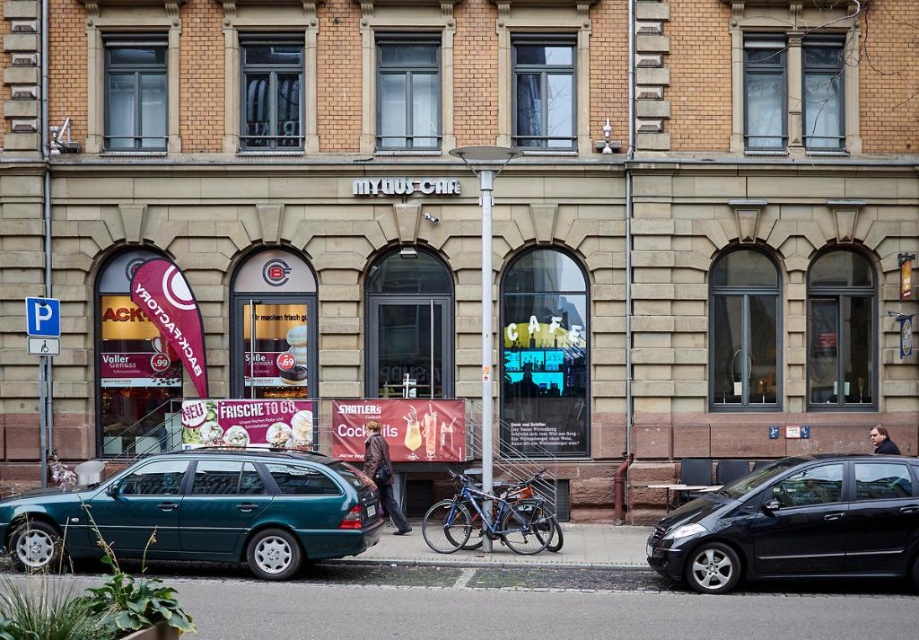
Question: Which object appears farthest from the camera in this image?

Choices:
 (A) black matte car at right
 (B) teal metallic station wagon at lower left

Answer: (B)

Question: Where is teal metallic station wagon at lower left located in relation to black matte car at right in the image?

Choices:
 (A) left
 (B) right

Answer: (A)

Question: Can you confirm if teal metallic station wagon at lower left is thinner than black matte car at right?

Choices:
 (A) no
 (B) yes

Answer: (A)

Question: Which point appears farthest from the camera in this image?

Choices:
 (A) (835, 468)
 (B) (320, 481)

Answer: (B)

Question: Observing the image, what is the correct spatial positioning of teal metallic station wagon at lower left in reference to black matte car at right?

Choices:
 (A) left
 (B) right

Answer: (A)